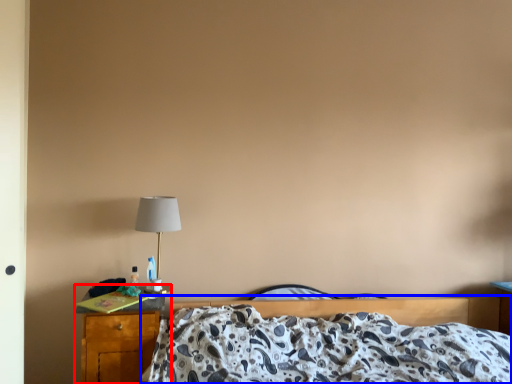
Question: Which of the following is the farthest to the observer, nightstand (highlighted by a red box) or bed (highlighted by a blue box)?

Choices:
 (A) nightstand
 (B) bed

Answer: (A)